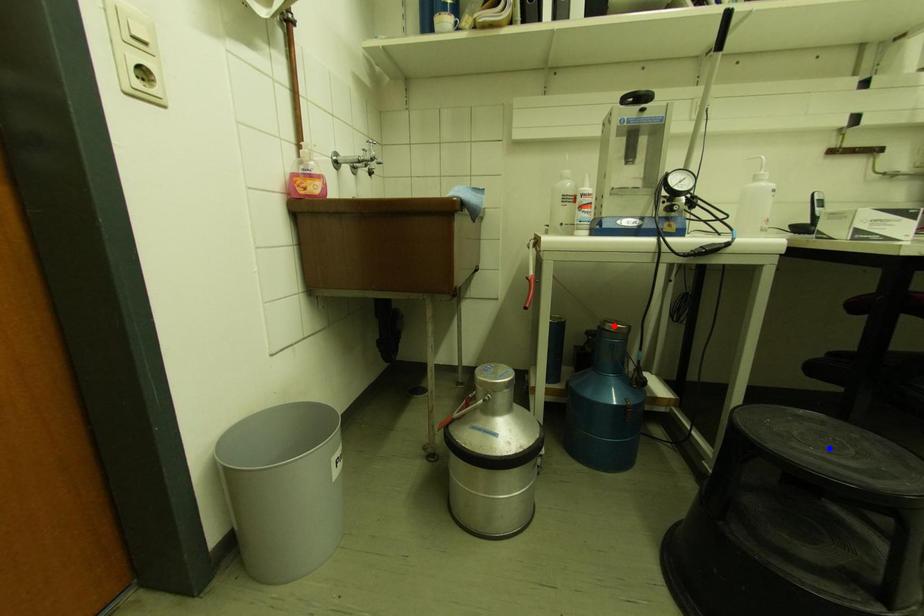
Question: In the image, two points are highlighted. Which point is nearer to the camera? Reply with the corresponding letter.

Choices:
 (A) blue point
 (B) red point

Answer: (A)